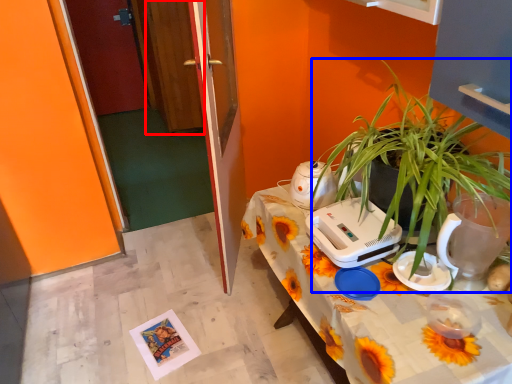
Question: Which of the following is the closest to the observer, glass door (highlighted by a red box) or houseplant (highlighted by a blue box)?

Choices:
 (A) glass door
 (B) houseplant

Answer: (B)